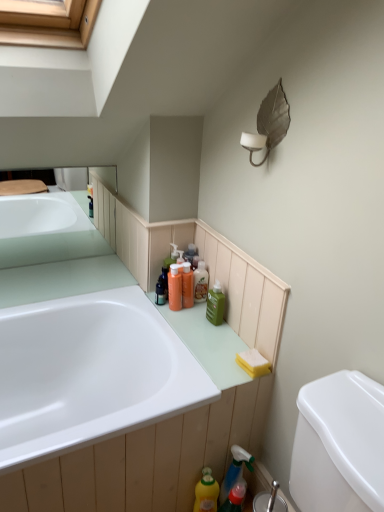
The height and width of the screenshot is (512, 384). I want to click on vacant space in front of orange plastic bottles at center, which is the first toiletry from left to right, so point(188,329).